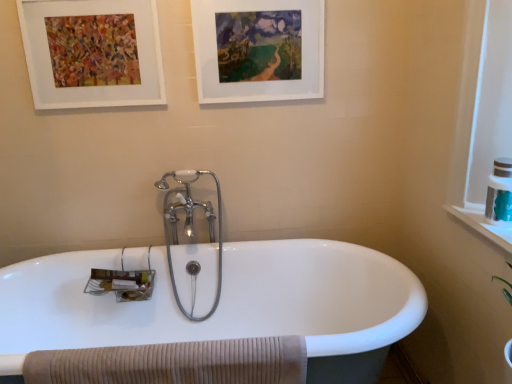
The height and width of the screenshot is (384, 512). Find the location of `white matte picture frame at upper center, arranged as the 1th picture frame when viewed from the right`. white matte picture frame at upper center, arranged as the 1th picture frame when viewed from the right is located at coordinates (258, 50).

What do you see at coordinates (175, 363) in the screenshot? I see `beige ribbed towel at lower left` at bounding box center [175, 363].

Find the location of a particular element. The width and height of the screenshot is (512, 384). white matte picture frame at upper left, placed as the 1th picture frame when sorted from left to right is located at coordinates (92, 53).

Looking at this image, is beige ribbed towel at lower left far away from white ceramic bathtub at center?

That's not correct — beige ribbed towel at lower left is a little close to white ceramic bathtub at center.

How different are the orientations of beige ribbed towel at lower left and white ceramic bathtub at center in degrees?

There is a 1.79-degree angle between the facing directions of beige ribbed towel at lower left and white ceramic bathtub at center.

Between beige ribbed towel at lower left and white ceramic bathtub at center, which one has smaller size?

With smaller size is beige ribbed towel at lower left.

Is the depth of white matte picture frame at upper center, arranged as the 1th picture frame when viewed from the right, greater than that of polished chrome faucet at center?

No, white matte picture frame at upper center, arranged as the 1th picture frame when viewed from the right, is in front of polished chrome faucet at center.

From the image's perspective, which picture frame is the 2nd one above the polished chrome faucet at center? Please provide its 2D coordinates.

[(258, 50)]

From the picture: What's the angular difference between white matte picture frame at upper center, arranged as the 1th picture frame when viewed from the right, and polished chrome faucet at center's facing directions?

They differ by 0.733 degrees in their facing directions.

Considering the relative sizes of white matte picture frame at upper center, the second picture frame viewed from the left, and polished chrome faucet at center in the image provided, is white matte picture frame at upper center, the second picture frame viewed from the left, taller than polished chrome faucet at center?

In fact, white matte picture frame at upper center, the second picture frame viewed from the left, may be shorter than polished chrome faucet at center.

From the image's perspective, which one is positioned higher, white matte picture frame at upper center, arranged as the 1th picture frame when viewed from the right, or beige ribbed towel at lower left?

white matte picture frame at upper center, arranged as the 1th picture frame when viewed from the right, appears higher in the image.

Is there a large distance between white matte picture frame at upper center, the second picture frame viewed from the left, and beige ribbed towel at lower left?

white matte picture frame at upper center, the second picture frame viewed from the left, is positioned a significant distance from beige ribbed towel at lower left.

From a real-world perspective, relative to beige ribbed towel at lower left, is white matte picture frame at upper center, the second picture frame viewed from the left, vertically above or below?

white matte picture frame at upper center, the second picture frame viewed from the left, is above beige ribbed towel at lower left.

Which point is more forward, (195,21) or (274,380)?

The point (274,380) is more forward.

Is teal plastic toiletry at right positioned with its back to beige ribbed towel at lower left?

No, teal plastic toiletry at right is not facing the opposite direction of beige ribbed towel at lower left.

Which of these two, teal plastic toiletry at right or beige ribbed towel at lower left, is wider?

teal plastic toiletry at right is wider.

Who is more distant, teal plastic toiletry at right or beige ribbed towel at lower left?

teal plastic toiletry at right is behind.

How many degrees apart are the facing directions of teal plastic toiletry at right and beige ribbed towel at lower left?

There is a 87.4-degree angle between the facing directions of teal plastic toiletry at right and beige ribbed towel at lower left.

From a real-world perspective, is teal plastic toiletry at right positioned above or below polished chrome faucet at center?

teal plastic toiletry at right is above polished chrome faucet at center.

Between teal plastic toiletry at right and polished chrome faucet at center, which one has smaller width?

With smaller width is teal plastic toiletry at right.

How different are the orientations of teal plastic toiletry at right and polished chrome faucet at center in degrees?

There is a 89.2-degree angle between the facing directions of teal plastic toiletry at right and polished chrome faucet at center.

Considering the sizes of teal plastic toiletry at right and white matte picture frame at upper left, acting as the 2th picture frame starting from the right, in the image, is teal plastic toiletry at right taller or shorter than white matte picture frame at upper left, acting as the 2th picture frame starting from the right,?

Considering their sizes, teal plastic toiletry at right has less height than white matte picture frame at upper left, acting as the 2th picture frame starting from the right.

Based on their sizes in the image, would you say teal plastic toiletry at right is bigger or smaller than white matte picture frame at upper left, acting as the 2th picture frame starting from the right?

Clearly, teal plastic toiletry at right is smaller in size than white matte picture frame at upper left, acting as the 2th picture frame starting from the right.

From the image's perspective, would you say teal plastic toiletry at right is positioned over white matte picture frame at upper left, acting as the 2th picture frame starting from the right?

No, from the image's perspective, teal plastic toiletry at right is not above white matte picture frame at upper left, acting as the 2th picture frame starting from the right.

Considering the relative sizes of teal plastic toiletry at right and white matte picture frame at upper left, acting as the 2th picture frame starting from the right, in the image provided, is teal plastic toiletry at right thinner than white matte picture frame at upper left, acting as the 2th picture frame starting from the right,?

In fact, teal plastic toiletry at right might be wider than white matte picture frame at upper left, acting as the 2th picture frame starting from the right.

In the image, is beige ribbed towel at lower left positioned in front of or behind white matte picture frame at upper center, the second picture frame viewed from the left?

beige ribbed towel at lower left is positioned closer to the viewer than white matte picture frame at upper center, the second picture frame viewed from the left.

From a real-world perspective, who is located lower, beige ribbed towel at lower left or white matte picture frame at upper center, arranged as the 1th picture frame when viewed from the right?

In real-world perspective, beige ribbed towel at lower left is lower.

Is beige ribbed towel at lower left oriented towards white matte picture frame at upper center, arranged as the 1th picture frame when viewed from the right?

No, beige ribbed towel at lower left is not facing towards white matte picture frame at upper center, arranged as the 1th picture frame when viewed from the right.

The width and height of the screenshot is (512, 384). In order to click on bathtub below the beige ribbed towel at lower left (from a real-world perspective) in this screenshot , I will do `click(222, 304)`.

Find the location of a particular element. Image resolution: width=512 pixels, height=384 pixels. picture frame to the right of polished chrome faucet at center is located at coordinates tap(258, 50).

Considering their positions, is teal plastic toiletry at right positioned further to polished chrome faucet at center than white matte picture frame at upper left, placed as the 1th picture frame when sorted from left to right?

Based on the image, teal plastic toiletry at right appears to be further to polished chrome faucet at center.

Estimate the real-world distances between objects in this image. Which object is further from teal plastic toiletry at right, white matte picture frame at upper left, acting as the 2th picture frame starting from the right, or white ceramic bathtub at center?

white matte picture frame at upper left, acting as the 2th picture frame starting from the right, lies further to teal plastic toiletry at right than the other object.

Which object lies nearer to the anchor point white matte picture frame at upper center, the second picture frame viewed from the left, polished chrome faucet at center or white matte picture frame at upper left, placed as the 1th picture frame when sorted from left to right?

white matte picture frame at upper left, placed as the 1th picture frame when sorted from left to right, lies closer to white matte picture frame at upper center, the second picture frame viewed from the left, than the other object.

Based on their spatial positions, is teal plastic toiletry at right or polished chrome faucet at center further from beige ribbed towel at lower left?

teal plastic toiletry at right is further to beige ribbed towel at lower left.

Which object lies further to the anchor point polished chrome faucet at center, white matte picture frame at upper center, arranged as the 1th picture frame when viewed from the right, or white ceramic bathtub at center?

white matte picture frame at upper center, arranged as the 1th picture frame when viewed from the right, is positioned further to the anchor polished chrome faucet at center.

Considering their positions, is beige ribbed towel at lower left positioned closer to white ceramic bathtub at center than polished chrome faucet at center?

polished chrome faucet at center.

From the image, which object appears to be farther from white matte picture frame at upper left, placed as the 1th picture frame when sorted from left to right, beige ribbed towel at lower left or white matte picture frame at upper center, arranged as the 1th picture frame when viewed from the right?

Based on the image, beige ribbed towel at lower left appears to be further to white matte picture frame at upper left, placed as the 1th picture frame when sorted from left to right.

Based on their spatial positions, is beige ribbed towel at lower left or white matte picture frame at upper left, acting as the 2th picture frame starting from the right, closer to polished chrome faucet at center?

Based on the image, white matte picture frame at upper left, acting as the 2th picture frame starting from the right, appears to be nearer to polished chrome faucet at center.

Image resolution: width=512 pixels, height=384 pixels. I want to click on picture frame located between polished chrome faucet at center and teal plastic toiletry at right in the left-right direction, so coord(258,50).

This screenshot has height=384, width=512. I want to click on picture frame that lies between white matte picture frame at upper center, arranged as the 1th picture frame when viewed from the right, and polished chrome faucet at center from top to bottom, so click(x=92, y=53).

In order to click on picture frame between white matte picture frame at upper center, arranged as the 1th picture frame when viewed from the right, and white ceramic bathtub at center vertically in this screenshot , I will do `click(92, 53)`.

Identify the location of bath towel situated between white matte picture frame at upper left, placed as the 1th picture frame when sorted from left to right, and teal plastic toiletry at right from left to right. This screenshot has width=512, height=384. (175, 363).